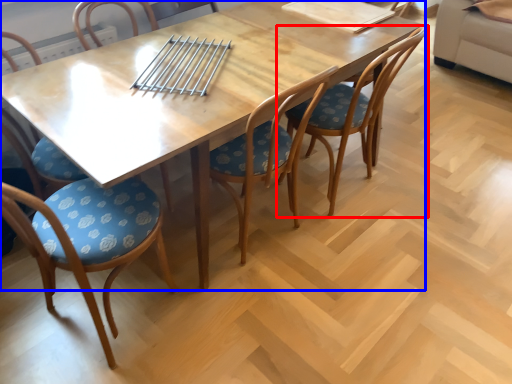
Question: Which of the following is the farthest to the observer, chair (highlighted by a red box) or table (highlighted by a blue box)?

Choices:
 (A) chair
 (B) table

Answer: (A)